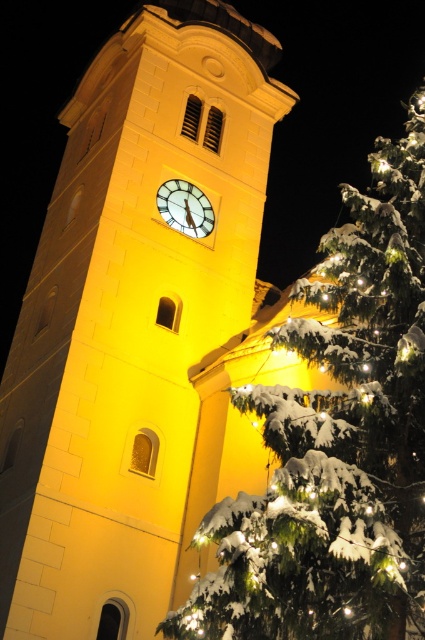
Question: Which object is closer to the camera taking this photo?

Choices:
 (A) snow-covered pine at right
 (B) yellow stone clock tower at center
 (C) white glossy clock at center

Answer: (A)

Question: Does yellow stone clock tower at center have a lesser width compared to snow-covered pine at right?

Choices:
 (A) no
 (B) yes

Answer: (A)

Question: Does yellow stone clock tower at center appear over snow-covered pine at right?

Choices:
 (A) yes
 (B) no

Answer: (A)

Question: Which is farther from the white glossy clock at center?

Choices:
 (A) snow-covered pine at right
 (B) yellow stone clock tower at center

Answer: (A)

Question: Can you confirm if yellow stone clock tower at center is smaller than snow-covered pine at right?

Choices:
 (A) yes
 (B) no

Answer: (B)

Question: Considering the real-world distances, which object is farthest from the snow-covered pine at right?

Choices:
 (A) white glossy clock at center
 (B) yellow stone clock tower at center

Answer: (A)